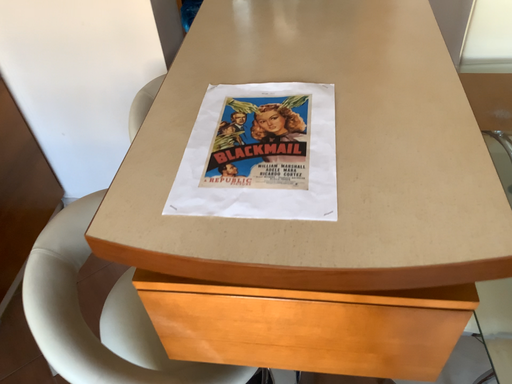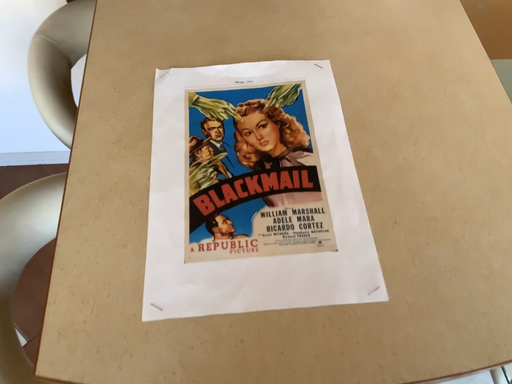
Question: How did the camera likely rotate when shooting the video?

Choices:
 (A) rotated upward
 (B) rotated downward

Answer: (B)